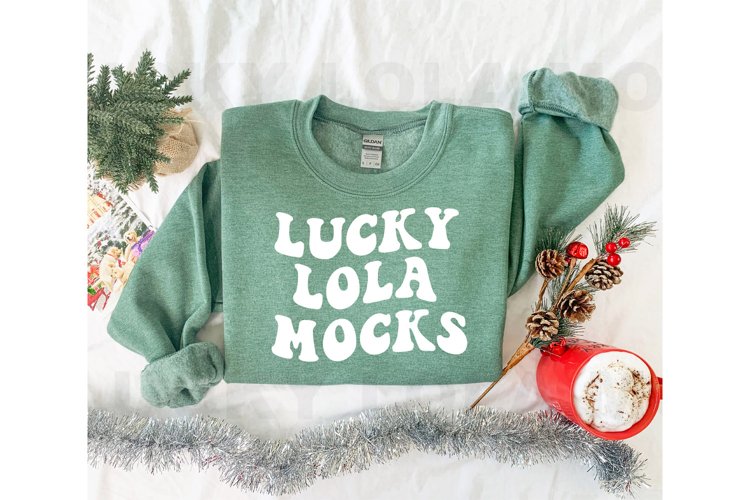
Locate an element on the screen. This screenshot has height=500, width=750. white substance in cup is located at coordinates (622, 388).